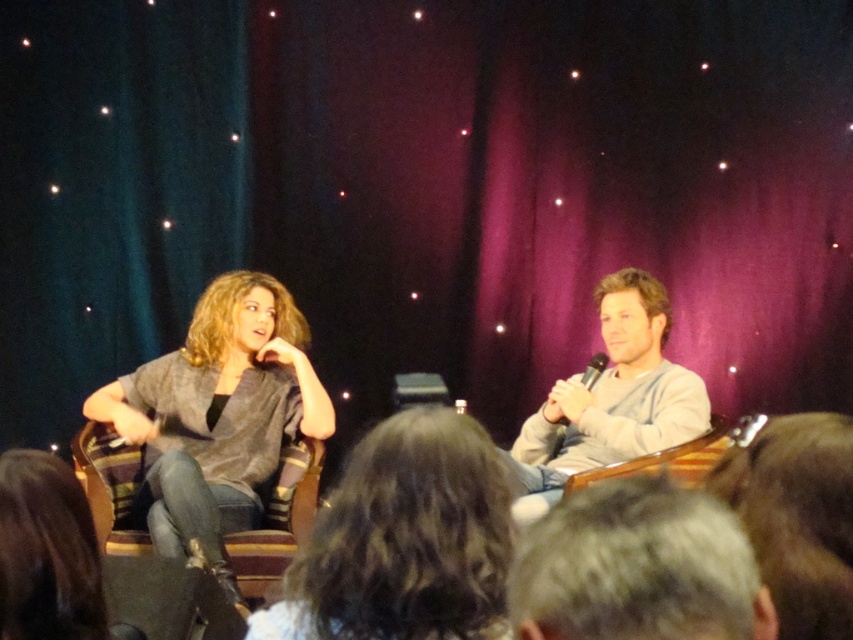
What do you see at coordinates (635, 566) in the screenshot?
I see `gray hair at center` at bounding box center [635, 566].

Can you confirm if gray hair at center is positioned below gray cotton shirt at right?

No, gray hair at center is not below gray cotton shirt at right.

Does point (683, 524) come behind point (556, 413)?

That is False.

At what (x,y) coordinates should I click in order to perform the action: click on gray hair at center. Please return your answer as a coordinate pair (x, y). The image size is (853, 640). Looking at the image, I should click on (635, 566).

Can you confirm if gray cotton shirt at right is wider than black plastic microphone at center?

Correct, the width of gray cotton shirt at right exceeds that of black plastic microphone at center.

Can you confirm if gray cotton shirt at right is thinner than black plastic microphone at center?

No.

Identify the location of gray cotton shirt at right. The height and width of the screenshot is (640, 853). (611, 397).

Is gray sweater at center bigger than gray hair at center?

Yes, gray sweater at center is bigger than gray hair at center.

Can you confirm if gray sweater at center is positioned below gray hair at center?

Yes.

Does point (366, 524) lie behind point (608, 516)?

Yes, point (366, 524) is farther from viewer.

Where is `gray sweater at center`? gray sweater at center is located at coordinates (404, 540).